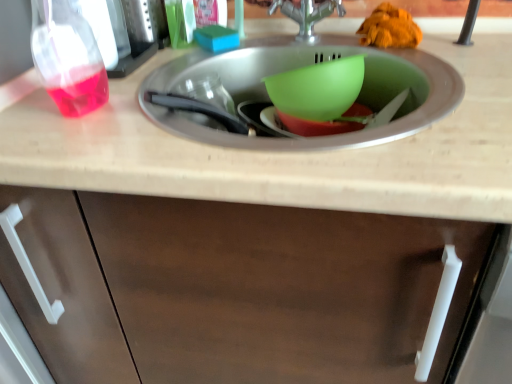
In order to click on free spot to the left of silver metallic tap at center in this screenshot , I will do `click(214, 53)`.